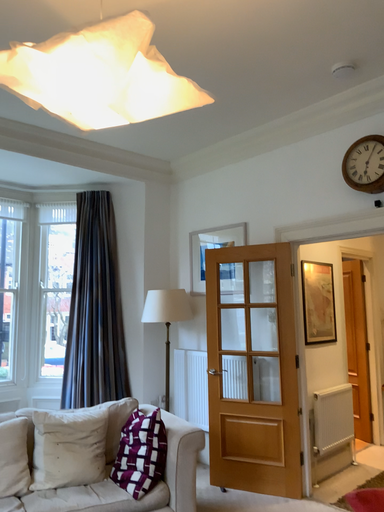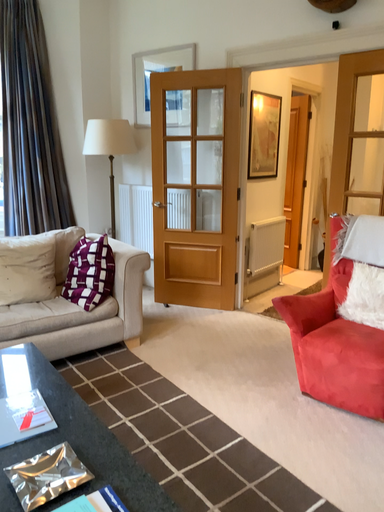
Question: How did the camera likely rotate when shooting the video?

Choices:
 (A) rotated upward
 (B) rotated downward

Answer: (B)